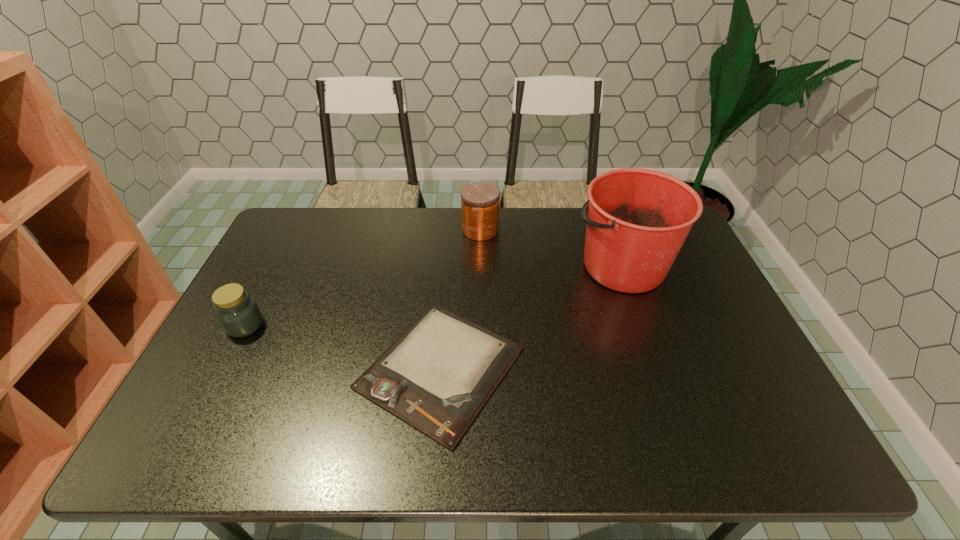
Identify the location of the tallest object. The height and width of the screenshot is (540, 960). (638, 219).

At what (x,y) coordinates should I click in order to perform the action: click on the rightmost object. Please return your answer as a coordinate pair (x, y). Looking at the image, I should click on (638, 219).

Where is `the farther jar`? the farther jar is located at coordinates (480, 201).

This screenshot has height=540, width=960. What are the coordinates of `the taller jar` in the screenshot? It's located at pyautogui.click(x=480, y=201).

Find the location of a particular element. the left jar is located at coordinates (239, 315).

Locate an element on the screen. This screenshot has height=540, width=960. the nearer jar is located at coordinates (239, 315).

Find the location of a particular element. This screenshot has height=540, width=960. the shortest object is located at coordinates (437, 375).

In order to click on blank space located on the left of the rightmost object in this screenshot , I will do coord(451,266).

Identify the location of blank area located on the right of the taller jar. (588, 230).

You are a GUI agent. You are given a task and a screenshot of the screen. Output one action in this format:
    pyautogui.click(x=<x>, y=<y>)
    Task: Click on the free space located 0.300m on the right of the shorter jar
    The image size is (960, 540).
    Given the screenshot: What is the action you would take?
    pyautogui.click(x=372, y=326)